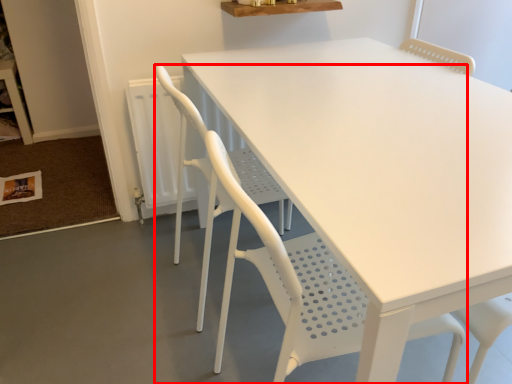
Question: From the image's perspective, what is the correct spatial positioning of chair (annotated by the red box) in reference to chair?

Choices:
 (A) above
 (B) below

Answer: (B)